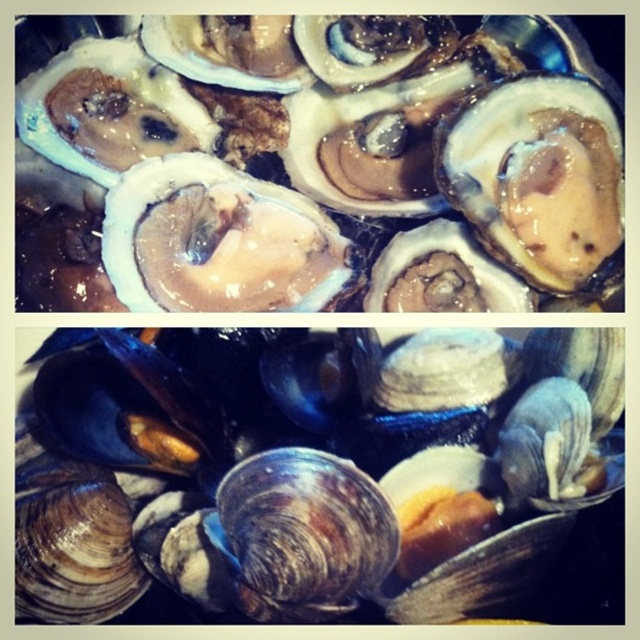
Is shiny white oyster at center to the left of shiny brown shellfish at center from the viewer's perspective?

Yes, shiny white oyster at center is to the left of shiny brown shellfish at center.

The width and height of the screenshot is (640, 640). I want to click on shiny white oyster at center, so click(330, 157).

Between point (534, 163) and point (296, 476), which one is positioned in front?

Point (296, 476) is more forward.

In order to click on shiny white oyster at center in this screenshot , I will do `click(330, 157)`.